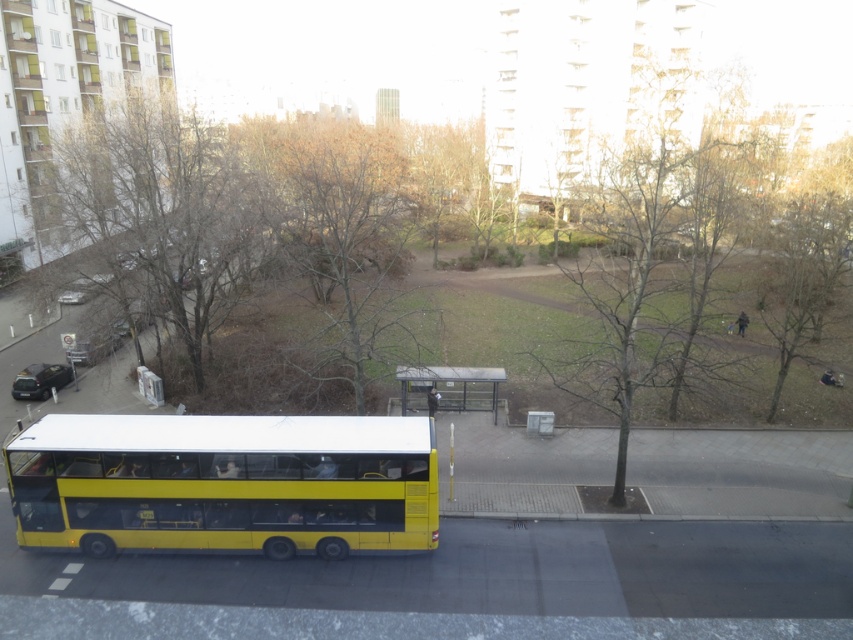
Consider the image. Is yellow matte bus at lower left above metallic silver bus stop at center?

Actually, yellow matte bus at lower left is below metallic silver bus stop at center.

Between yellow matte bus at lower left and metallic silver bus stop at center, which one appears on the left side from the viewer's perspective?

yellow matte bus at lower left is more to the left.

Locate an element on the screen. yellow matte bus at lower left is located at coordinates (225, 483).

Who is more distant from viewer, (648, 198) or (268, 204)?

The point (648, 198) is behind.

Does point (671, 202) come farther from viewer compared to point (358, 228)?

Yes, point (671, 202) is behind point (358, 228).

I want to click on bare branches at center, so click(x=653, y=228).

The width and height of the screenshot is (853, 640). What are the coordinates of `yellow matte bus at lower left` in the screenshot? It's located at (225, 483).

Which is behind, point (384, 502) or point (376, 234)?

Point (376, 234)

At what (x,y) coordinates should I click in order to perform the action: click on yellow matte bus at lower left. Please return your answer as a coordinate pair (x, y). This screenshot has width=853, height=640. Looking at the image, I should click on (225, 483).